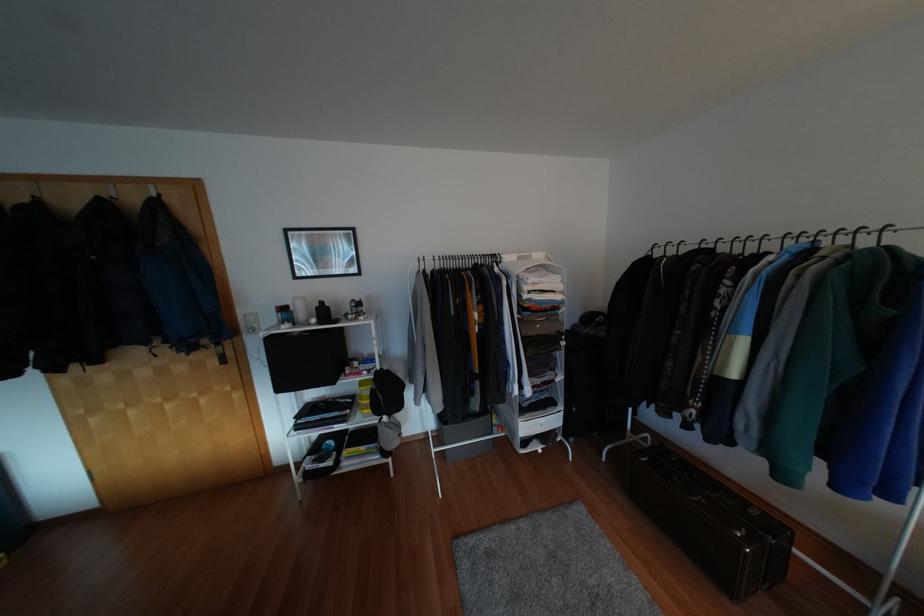
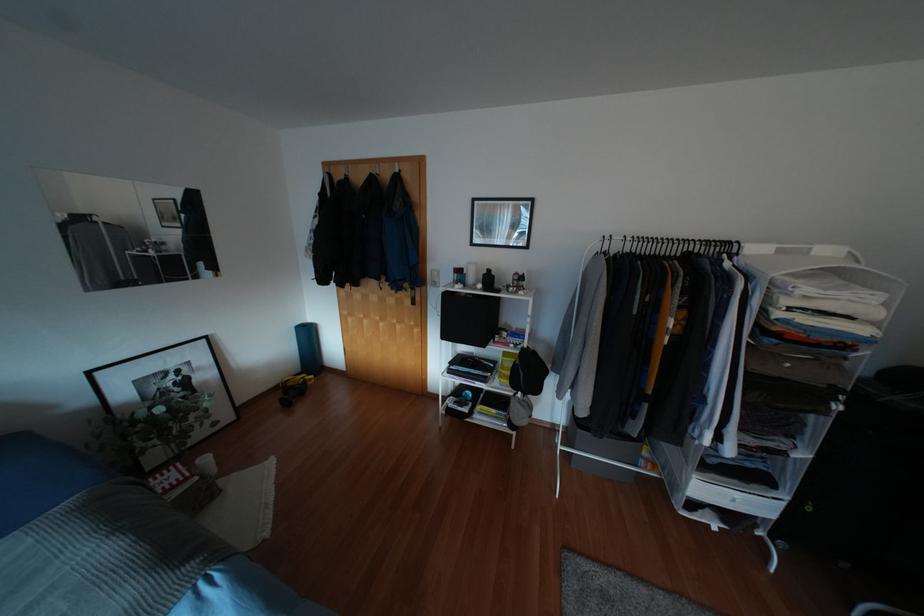
Locate, in the second image, the point that corresponds to point (320, 323) in the first image.

(483, 289)